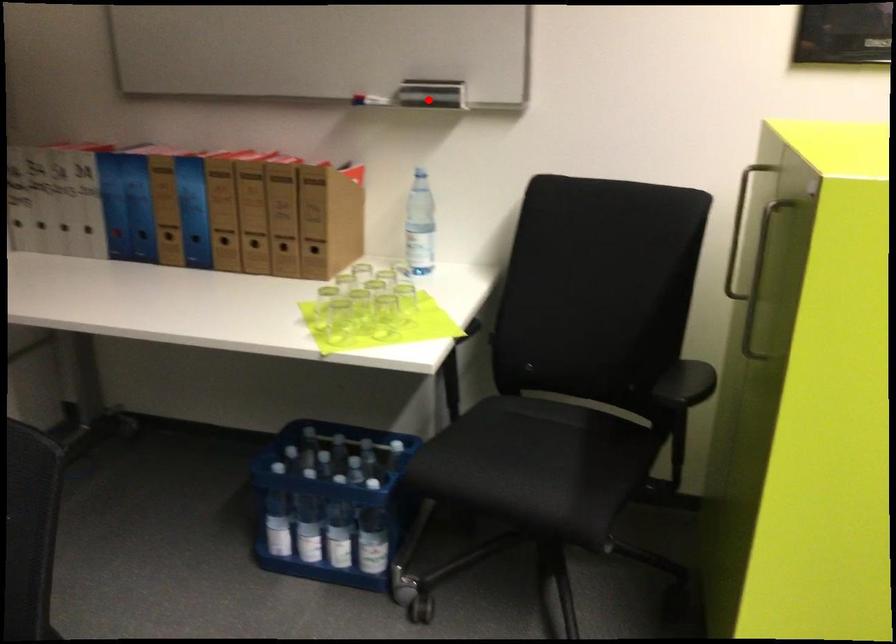
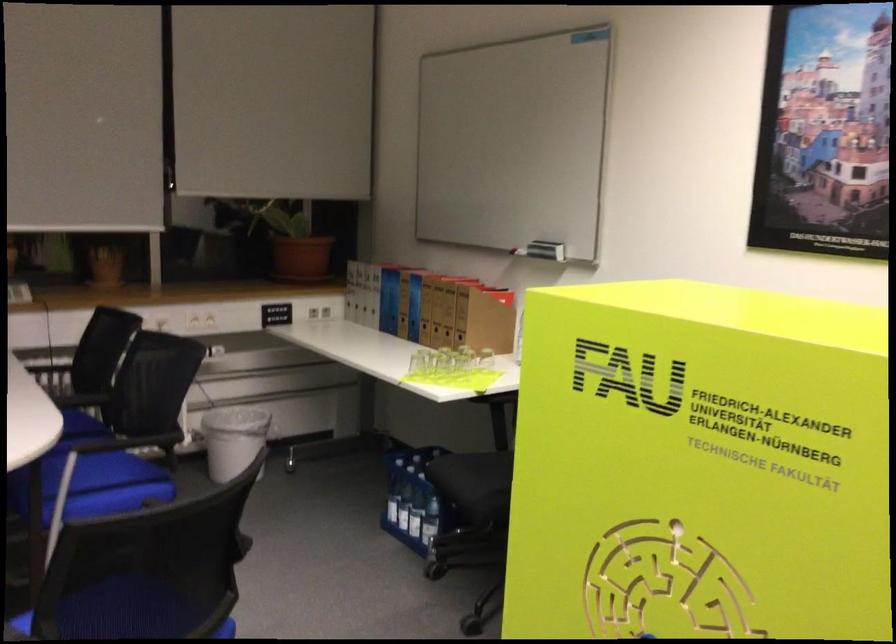
Locate, in the second image, the point that corresponds to the highlighted location in the first image.

(546, 250)